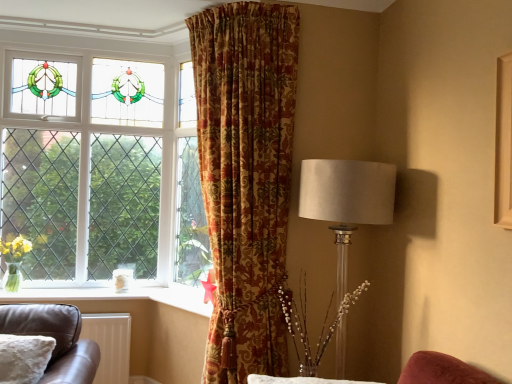
Question: Considering the relative positions of clear glass window at upper left and white matte radiator at lower left in the image provided, is clear glass window at upper left to the right of white matte radiator at lower left from the viewer's perspective?

Choices:
 (A) yes
 (B) no

Answer: (B)

Question: From a real-world perspective, is clear glass window at upper left positioned under white matte radiator at lower left based on gravity?

Choices:
 (A) yes
 (B) no

Answer: (B)

Question: Is clear glass window at upper left looking in the opposite direction of white matte radiator at lower left?

Choices:
 (A) yes
 (B) no

Answer: (B)

Question: Is clear glass window at upper left positioned behind white matte radiator at lower left?

Choices:
 (A) yes
 (B) no

Answer: (A)

Question: Is clear glass window at upper left wider than white matte radiator at lower left?

Choices:
 (A) yes
 (B) no

Answer: (B)

Question: From a real-world perspective, is satin white lampshade at right positioned above or below gold-patterned curtain at center?

Choices:
 (A) above
 (B) below

Answer: (B)

Question: In the image, is satin white lampshade at right positioned in front of or behind gold-patterned curtain at center?

Choices:
 (A) front
 (B) behind

Answer: (B)

Question: Considering the positions of satin white lampshade at right and gold-patterned curtain at center in the image, is satin white lampshade at right bigger or smaller than gold-patterned curtain at center?

Choices:
 (A) big
 (B) small

Answer: (B)

Question: In terms of width, does satin white lampshade at right look wider or thinner when compared to gold-patterned curtain at center?

Choices:
 (A) thin
 (B) wide

Answer: (A)

Question: Is clear glass window at upper left taller or shorter than translucent glass vase at center, placed as the 1th floral arrangement when sorted from right to left?

Choices:
 (A) short
 (B) tall

Answer: (B)

Question: Looking at their shapes, would you say clear glass window at upper left is wider or thinner than translucent glass vase at center, which appears as the second floral arrangement when viewed from the left?

Choices:
 (A) thin
 (B) wide

Answer: (A)

Question: Is point (23, 271) positioned closer to the camera than point (365, 281)?

Choices:
 (A) closer
 (B) farther

Answer: (B)

Question: Is clear glass window at upper left in front of or behind translucent glass vase at center, placed as the 1th floral arrangement when sorted from right to left, in the image?

Choices:
 (A) behind
 (B) front

Answer: (A)

Question: Considering the positions of translucent glass vase with yellow flowers at left, the first floral arrangement positioned from the left, and translucent glass vase at center, the first floral arrangement from the front, in the image, is translucent glass vase with yellow flowers at left, the first floral arrangement positioned from the left, wider or thinner than translucent glass vase at center, the first floral arrangement from the front,?

Choices:
 (A) thin
 (B) wide

Answer: (A)

Question: From the image's perspective, is translucent glass vase with yellow flowers at left, arranged as the 1th floral arrangement when viewed from the back, above or below translucent glass vase at center, placed as the 1th floral arrangement when sorted from right to left?

Choices:
 (A) above
 (B) below

Answer: (A)